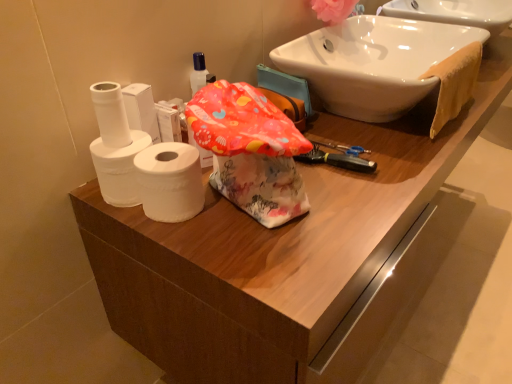
Based on the photo, how much space does white matte toilet paper at left, placed as the 2th toilet paper when sorted from left to right, occupy vertically?

The height of white matte toilet paper at left, placed as the 2th toilet paper when sorted from left to right, is 4.11 inches.

What do you see at coordinates (333, 10) in the screenshot?
I see `pink fabric flower at upper right` at bounding box center [333, 10].

Where is `white matte toilet paper at left, placed as the 2th toilet paper when sorted from left to right`? white matte toilet paper at left, placed as the 2th toilet paper when sorted from left to right is located at coordinates (119, 169).

How many degrees apart are the facing directions of white glossy sink at upper right and white matte toilet paper at left, positioned as the first toilet paper in right-to-left order?

The facing directions of white glossy sink at upper right and white matte toilet paper at left, positioned as the first toilet paper in right-to-left order, are 88.8 degrees apart.

Based on the photo, considering the sizes of objects white glossy sink at upper right and white matte toilet paper at left, positioned as the first toilet paper in right-to-left order, in the image provided, who is smaller, white glossy sink at upper right or white matte toilet paper at left, positioned as the first toilet paper in right-to-left order,?

white matte toilet paper at left, positioned as the first toilet paper in right-to-left order.

Considering the relative sizes of white glossy sink at upper right and white matte toilet paper at left, positioned as the first toilet paper in right-to-left order, in the image provided, is white glossy sink at upper right shorter than white matte toilet paper at left, positioned as the first toilet paper in right-to-left order,?

Incorrect, the height of white glossy sink at upper right does not fall short of that of white matte toilet paper at left, positioned as the first toilet paper in right-to-left order.

Would you say white glossy sink at upper right is outside white matte toilet paper at left, positioned as the first toilet paper in right-to-left order?

white glossy sink at upper right lies outside white matte toilet paper at left, positioned as the first toilet paper in right-to-left order,'s area.

From a real-world perspective, which toilet paper is the 2nd one underneath the white matte toilet paper at left, the first toilet paper from the left? Please provide its 2D coordinates.

[(119, 169)]

Considering the positions of points (118, 122) and (122, 165), is point (118, 122) closer to camera compared to point (122, 165)?

No, (118, 122) is further to viewer.

From a real-world perspective, which is physically above, white matte toilet paper at left, the first toilet paper from the left, or white matte toilet paper at left, placed as the 2th toilet paper when sorted from left to right?

From a 3D spatial view, white matte toilet paper at left, the first toilet paper from the left, is above.

How many degrees apart are the facing directions of orange cloth towel at upper right and white matte toilet paper at left, positioned as the 3th toilet paper in right-to-left order?

There is a 90.1-degree angle between the facing directions of orange cloth towel at upper right and white matte toilet paper at left, positioned as the 3th toilet paper in right-to-left order.

This screenshot has height=384, width=512. Identify the location of bath towel on the right of white matte toilet paper at left, positioned as the 3th toilet paper in right-to-left order. (454, 83).

Is point (442, 93) closer to camera compared to point (98, 99)?

No.

Is orange cloth towel at upper right smaller than white matte toilet paper at left, the first toilet paper from the left?

No.

Is orange cloth towel at upper right oriented towards pink fabric flower at upper right?

No.

Consider the image. Can you confirm if orange cloth towel at upper right is positioned to the right of pink fabric flower at upper right?

Correct, you'll find orange cloth towel at upper right to the right of pink fabric flower at upper right.

Considering the relative sizes of orange cloth towel at upper right and pink fabric flower at upper right in the image provided, is orange cloth towel at upper right bigger than pink fabric flower at upper right?

Yes, orange cloth towel at upper right is bigger than pink fabric flower at upper right.

Which is behind, orange cloth towel at upper right or pink fabric flower at upper right?

Positioned behind is pink fabric flower at upper right.

Does white matte toilet paper at left, positioned as the first toilet paper in right-to-left order, turn towards white matte toilet paper at left, the 2th toilet paper positioned from the right?

No, white matte toilet paper at left, positioned as the first toilet paper in right-to-left order, does not turn towards white matte toilet paper at left, the 2th toilet paper positioned from the right.

Considering the relative sizes of white matte toilet paper at left, arranged as the 3th toilet paper when viewed from the left, and white matte toilet paper at left, placed as the 2th toilet paper when sorted from left to right, in the image provided, is white matte toilet paper at left, arranged as the 3th toilet paper when viewed from the left, bigger than white matte toilet paper at left, placed as the 2th toilet paper when sorted from left to right,?

No.

Considering the relative positions of white matte toilet paper at left, positioned as the first toilet paper in right-to-left order, and white matte toilet paper at left, the 2th toilet paper positioned from the right, in the image provided, is white matte toilet paper at left, positioned as the first toilet paper in right-to-left order, to the left or to the right of white matte toilet paper at left, the 2th toilet paper positioned from the right,?

Clearly, white matte toilet paper at left, positioned as the first toilet paper in right-to-left order, is on the right of white matte toilet paper at left, the 2th toilet paper positioned from the right, in the image.

Is point (200, 183) less distant than point (111, 184)?

No, it is behind (111, 184).

Would you consider white matte toilet paper at left, the 2th toilet paper positioned from the right, to be distant from pink fabric flower at upper right?

They are positioned close to each other.

Is white matte toilet paper at left, the 2th toilet paper positioned from the right, to the left of pink fabric flower at upper right from the viewer's perspective?

Indeed, white matte toilet paper at left, the 2th toilet paper positioned from the right, is positioned on the left side of pink fabric flower at upper right.

Is white matte toilet paper at left, the 2th toilet paper positioned from the right, positioned with its back to pink fabric flower at upper right?

Yes, white matte toilet paper at left, the 2th toilet paper positioned from the right, is positioned with its back facing pink fabric flower at upper right.

Measure the distance from white matte toilet paper at left, positioned as the first toilet paper in right-to-left order, to orange cloth towel at upper right.

white matte toilet paper at left, positioned as the first toilet paper in right-to-left order, and orange cloth towel at upper right are 26.04 inches apart from each other.

Which point is more distant from viewer, (150, 208) or (458, 98)?

The point (458, 98) is more distant.

In terms of size, does white matte toilet paper at left, arranged as the 3th toilet paper when viewed from the left, appear bigger or smaller than orange cloth towel at upper right?

In the image, white matte toilet paper at left, arranged as the 3th toilet paper when viewed from the left, appears to be smaller than orange cloth towel at upper right.

Considering the sizes of white matte toilet paper at left, arranged as the 3th toilet paper when viewed from the left, and orange cloth towel at upper right in the image, is white matte toilet paper at left, arranged as the 3th toilet paper when viewed from the left, taller or shorter than orange cloth towel at upper right?

Considering their sizes, white matte toilet paper at left, arranged as the 3th toilet paper when viewed from the left, has less height than orange cloth towel at upper right.

Where is `sink on the right of white matte toilet paper at left, positioned as the first toilet paper in right-to-left order`? sink on the right of white matte toilet paper at left, positioned as the first toilet paper in right-to-left order is located at coordinates (373, 63).

The height and width of the screenshot is (384, 512). In order to click on toilet paper above the white matte toilet paper at left, placed as the 2th toilet paper when sorted from left to right (from the image's perspective) in this screenshot , I will do `click(110, 114)`.

Looking at the image, which one is located further to pink fabric flower at upper right, white matte toilet paper at left, the first toilet paper from the left, or white matte toilet paper at left, placed as the 2th toilet paper when sorted from left to right?

white matte toilet paper at left, placed as the 2th toilet paper when sorted from left to right, is further to pink fabric flower at upper right.

Estimate the real-world distances between objects in this image. Which object is further from orange cloth towel at upper right, white matte toilet paper at left, positioned as the first toilet paper in right-to-left order, or pink fabric flower at upper right?

white matte toilet paper at left, positioned as the first toilet paper in right-to-left order, lies further to orange cloth towel at upper right than the other object.

Estimate the real-world distances between objects in this image. Which object is further from pink fabric flower at upper right, white matte toilet paper at left, the first toilet paper from the left, or white glossy sink at upper right?

white matte toilet paper at left, the first toilet paper from the left, lies further to pink fabric flower at upper right than the other object.

Based on their spatial positions, is white matte toilet paper at left, arranged as the 3th toilet paper when viewed from the left, or white glossy sink at upper right further from orange cloth towel at upper right?

white matte toilet paper at left, arranged as the 3th toilet paper when viewed from the left, lies further to orange cloth towel at upper right than the other object.

When comparing their distances from white matte toilet paper at left, positioned as the 3th toilet paper in right-to-left order, does white glossy sink at upper right or white matte toilet paper at left, arranged as the 3th toilet paper when viewed from the left, seem closer?

white matte toilet paper at left, arranged as the 3th toilet paper when viewed from the left, is positioned closer to the anchor white matte toilet paper at left, positioned as the 3th toilet paper in right-to-left order.

From the image, which object appears to be farther from pink fabric flower at upper right, orange cloth towel at upper right or white glossy sink at upper right?

The object further to pink fabric flower at upper right is orange cloth towel at upper right.

Estimate the real-world distances between objects in this image. Which object is further from white glossy sink at upper right, white matte toilet paper at left, positioned as the first toilet paper in right-to-left order, or orange cloth towel at upper right?

The object further to white glossy sink at upper right is white matte toilet paper at left, positioned as the first toilet paper in right-to-left order.

Looking at the image, which one is located further to pink fabric flower at upper right, white matte toilet paper at left, arranged as the 3th toilet paper when viewed from the left, or white glossy sink at upper right?

white matte toilet paper at left, arranged as the 3th toilet paper when viewed from the left, is positioned further to the anchor pink fabric flower at upper right.

I want to click on toilet paper between white matte toilet paper at left, the first toilet paper from the left, and white matte toilet paper at left, positioned as the first toilet paper in right-to-left order, in the up-down direction, so click(x=119, y=169).

Find the location of a particular element. sink between pink fabric flower at upper right and white matte toilet paper at left, arranged as the 3th toilet paper when viewed from the left, from top to bottom is located at coordinates (373, 63).

Image resolution: width=512 pixels, height=384 pixels. Identify the location of toilet paper between white matte toilet paper at left, placed as the 2th toilet paper when sorted from left to right, and white glossy sink at upper right from left to right. (170, 182).

At what (x,y) coordinates should I click in order to perform the action: click on flower situated between white matte toilet paper at left, placed as the 2th toilet paper when sorted from left to right, and orange cloth towel at upper right from left to right. Please return your answer as a coordinate pair (x, y). This screenshot has height=384, width=512. Looking at the image, I should click on (333, 10).